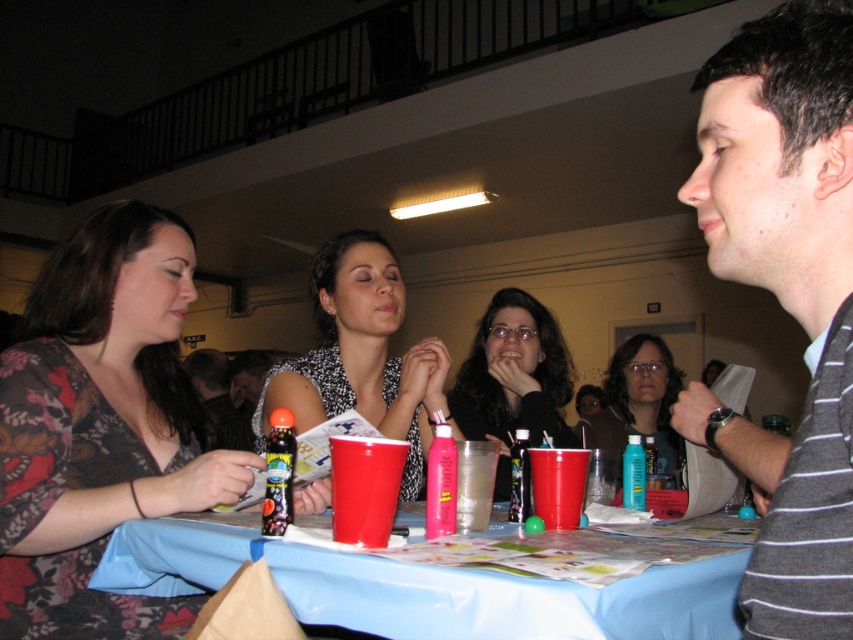
Question: Which point is farther to the camera?

Choices:
 (A) matte black jacket at center
 (B) matte black hair at center
 (C) translucent plastic can at table center
 (D) matte black dress at center

Answer: (B)

Question: Does gray striped shirt at right appear under matte black jacket at center?

Choices:
 (A) yes
 (B) no

Answer: (B)

Question: Does blue plastic table at center have a lesser width compared to matte plastic cup at table center?

Choices:
 (A) yes
 (B) no

Answer: (B)

Question: Which point appears farthest from the camera in this image?

Choices:
 (A) tap(497, 305)
 (B) tap(277, 515)
 (C) tap(149, 224)
 (D) tap(404, 458)

Answer: (A)

Question: Does floral fabric shirt at left appear under pink plastic cup at table center?

Choices:
 (A) no
 (B) yes

Answer: (A)

Question: Which point appears closest to the camera in this image?

Choices:
 (A) (24, 365)
 (B) (444, 460)

Answer: (B)